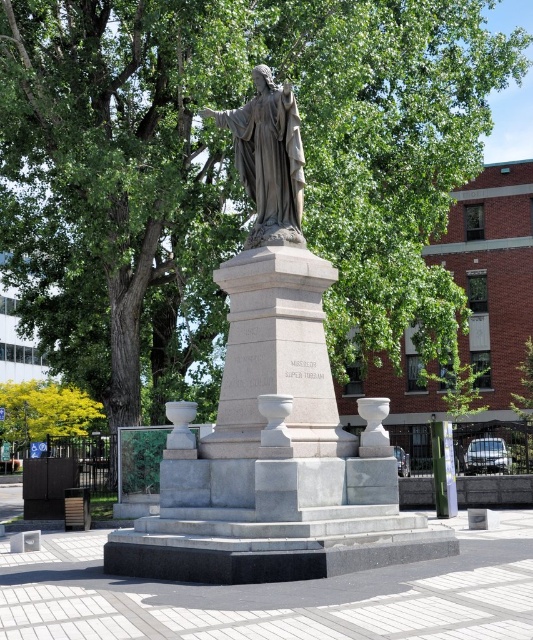
Question: Is matte gray statue at center thinner than yellow-green leaves at lower left?

Choices:
 (A) yes
 (B) no

Answer: (A)

Question: Can you confirm if matte gray statue at center is smaller than yellow-green leaves at lower left?

Choices:
 (A) no
 (B) yes

Answer: (B)

Question: In this image, where is matte gray statue at center located relative to yellow-green leaves at lower left?

Choices:
 (A) below
 (B) above

Answer: (B)

Question: Which point is farther to the camera?

Choices:
 (A) matte gray statue at center
 (B) yellow-green leaves at lower left

Answer: (B)

Question: Which object is farther from the camera taking this photo?

Choices:
 (A) yellow-green leaves at lower left
 (B) matte gray statue at center

Answer: (A)